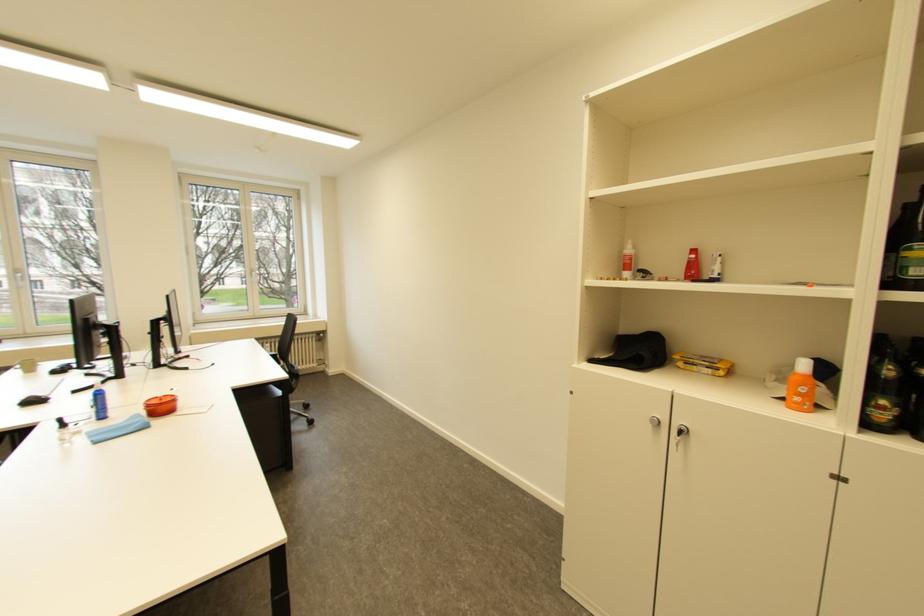
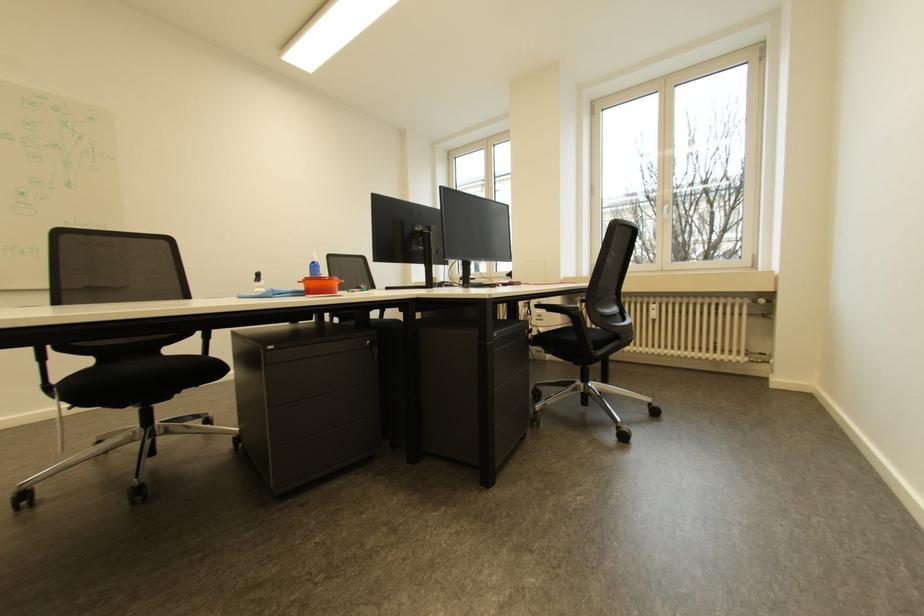
Where in the second image is the point corresponding to the point at 323,336 from the first image?

(757, 302)